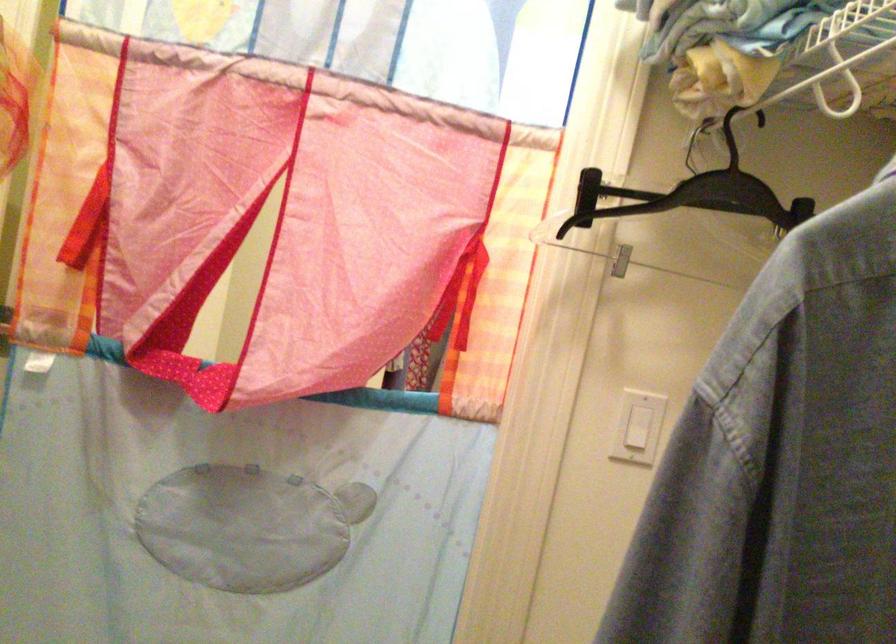
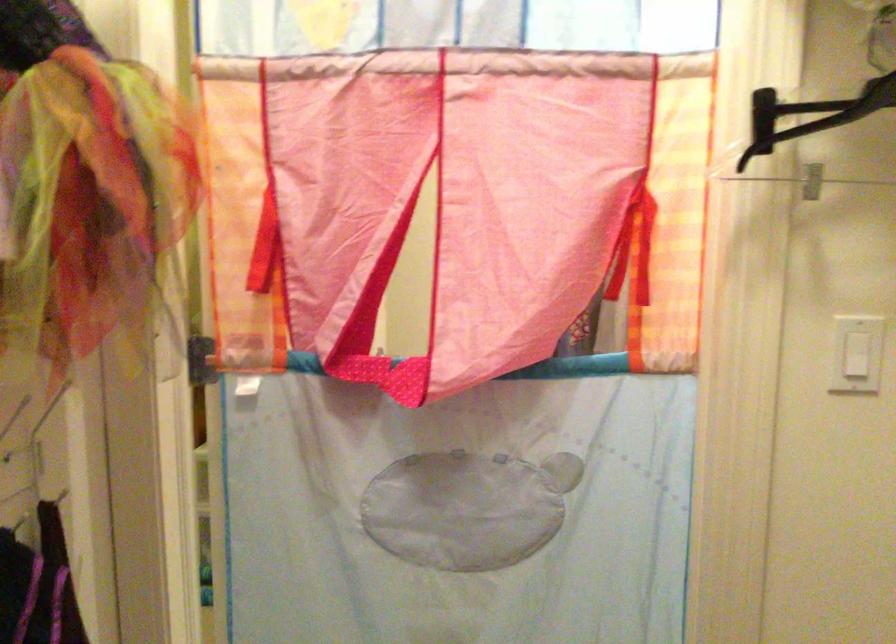
Question: Based on the continuous images, in which direction is the camera rotating? Reply with the corresponding letter.

Choices:
 (A) Left
 (B) Right
 (C) Up
 (D) Down

Answer: (A)